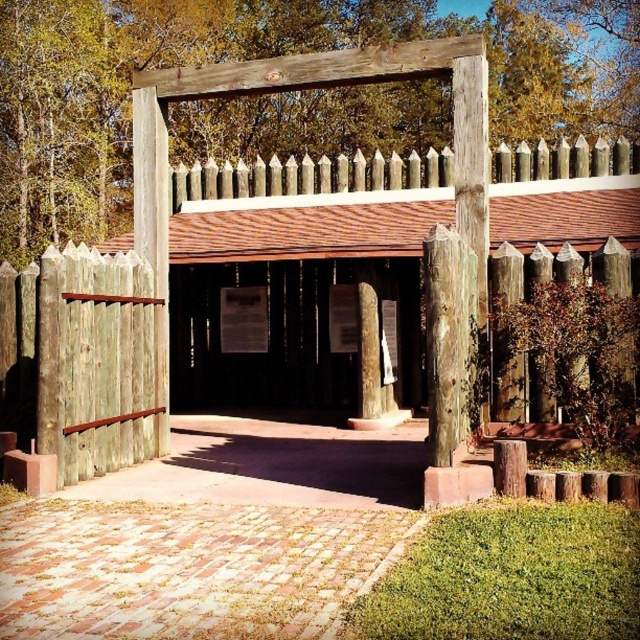
You are a tour guide leading a group to the entrance of the historical site. You see the wooden signpost at center and the weathered wood gate at center. Which object is positioned lower in the image?

The wooden signpost at center is below the weathered wood gate at center, so the wooden signpost at center is positioned lower in the image.

You are a delivery person trying to determine the best path to the entrance. You see a wooden signpost at center and a weathered wood gate at center. Which object is narrower?

The wooden signpost at center is thinner than the weathered wood gate at center, so the wooden signpost at center is narrower.